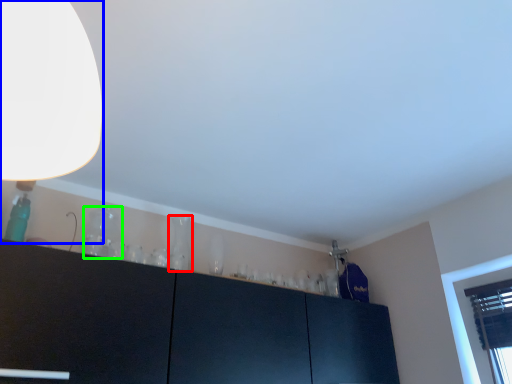
Question: Based on their relative distances, which object is farther from glass vase (highlighted by a red box)? Choose from lamp (highlighted by a blue box) and glass vase (highlighted by a green box).

Choices:
 (A) lamp
 (B) glass vase

Answer: (A)